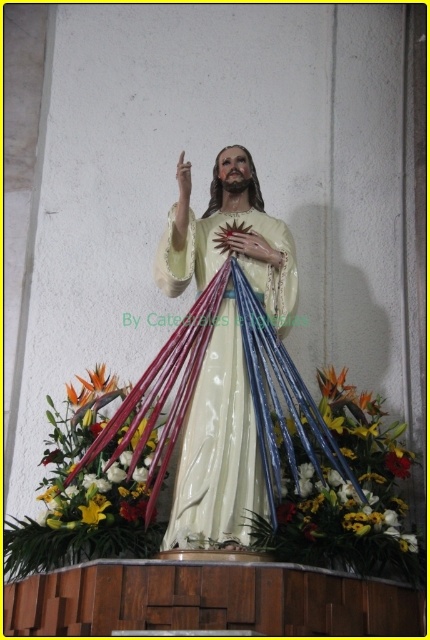
Does matte porcelain statue at center appear on the left side of vibrant floral bouquet at center?

Yes, matte porcelain statue at center is to the left of vibrant floral bouquet at center.

Is matte porcelain statue at center wider than vibrant floral bouquet at center?

Answer: Correct, the width of matte porcelain statue at center exceeds that of vibrant floral bouquet at center.

The image size is (430, 640). Describe the element at coordinates (218, 445) in the screenshot. I see `matte porcelain statue at center` at that location.

This screenshot has height=640, width=430. What are the coordinates of `matte porcelain statue at center` in the screenshot? It's located at (218, 445).

Is matte porcelain statue at center closer to camera compared to white glossy petals at lower center?

Yes, it is.

Based on the photo, is matte porcelain statue at center thinner than white glossy petals at lower center?

Incorrect, matte porcelain statue at center's width is not less than white glossy petals at lower center's.

The width and height of the screenshot is (430, 640). What do you see at coordinates (218, 445) in the screenshot?
I see `matte porcelain statue at center` at bounding box center [218, 445].

Locate an element on the screen. matte porcelain statue at center is located at coordinates (218, 445).

Does vibrant floral bouquet at center have a lesser width compared to white glossy petals at lower center?

No, vibrant floral bouquet at center is not thinner than white glossy petals at lower center.

Between vibrant floral bouquet at center and white glossy petals at lower center, which one appears on the right side from the viewer's perspective?

Positioned to the right is vibrant floral bouquet at center.

Does point (368, 490) come closer to viewer compared to point (134, 444)?

Yes, point (368, 490) is closer to viewer.

At what (x,y) coordinates should I click in order to perform the action: click on vibrant floral bouquet at center. Please return your answer as a coordinate pair (x, y). Looking at the image, I should click on (353, 472).